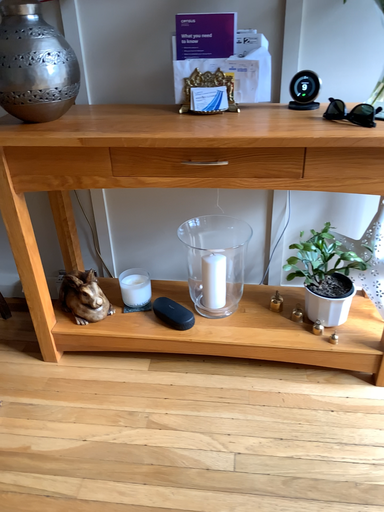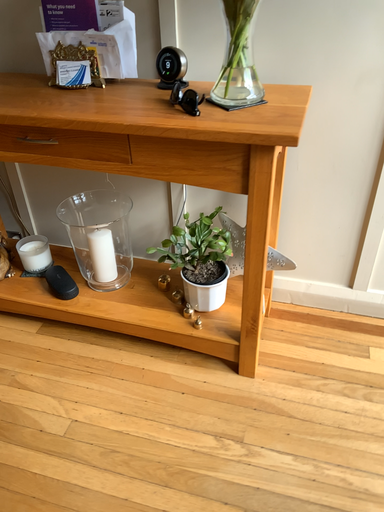
Question: Which way did the camera rotate in the video?

Choices:
 (A) rotated right
 (B) rotated left

Answer: (B)